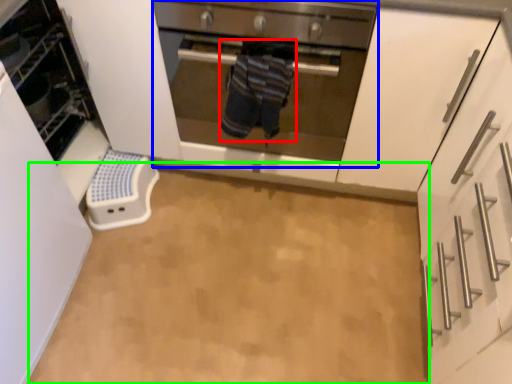
Question: Which object is positioned closest to person (highlighted by a red box)? Select from oven (highlighted by a blue box) and plain (highlighted by a green box).

Choices:
 (A) oven
 (B) plain

Answer: (A)